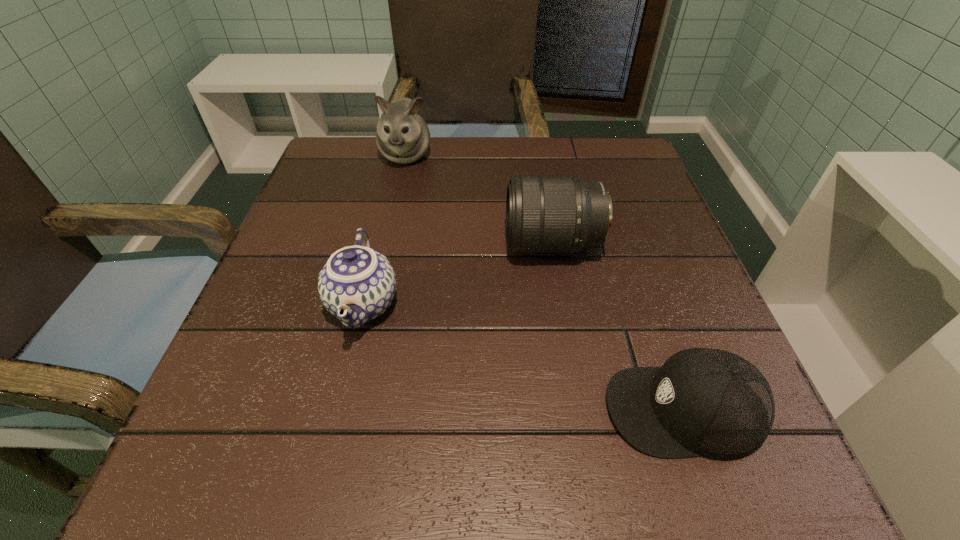
At what (x,y) coordinates should I click in order to perform the action: click on hamster. Please return your answer as a coordinate pair (x, y). The image size is (960, 540). Looking at the image, I should click on (402, 136).

Image resolution: width=960 pixels, height=540 pixels. In order to click on telephoto lens in this screenshot , I will do `click(544, 214)`.

Find the location of `the third tallest object`. the third tallest object is located at coordinates (357, 284).

In order to click on the shortest object in this screenshot , I will do `click(707, 402)`.

The image size is (960, 540). I want to click on cap, so click(707, 402).

The image size is (960, 540). Find the location of `free spot located 0.160m on the face of the farthest object`. free spot located 0.160m on the face of the farthest object is located at coordinates (392, 219).

You are a GUI agent. You are given a task and a screenshot of the screen. Output one action in this format:
    pyautogui.click(x=<x>, y=<y>)
    Task: Click on the vacant area situated 0.160m on the surface of the telephoto lens
    This screenshot has width=960, height=540.
    Given the screenshot: What is the action you would take?
    pyautogui.click(x=422, y=244)

You are a GUI agent. You are given a task and a screenshot of the screen. Output one action in this format:
    pyautogui.click(x=<x>, y=<y>)
    Task: Click on the free space located on the surface of the telephoto lens
    
    Given the screenshot: What is the action you would take?
    pyautogui.click(x=354, y=244)

Locate an element on the screen. vacant space located 0.110m on the surface of the telephoto lens is located at coordinates (448, 244).

What are the coordinates of `free space located from the spout of the second shortest object` in the screenshot? It's located at (343, 389).